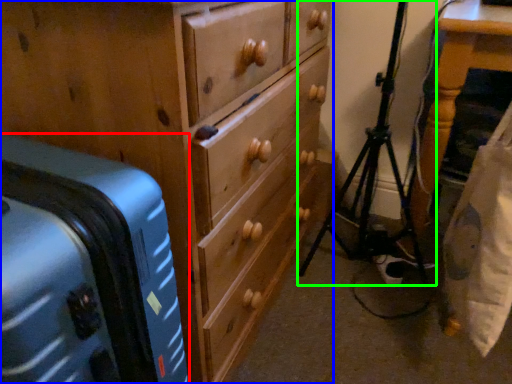
Question: Which object is positioned farthest from suitcase (highlighted by a red box)? Select from chest of drawers (highlighted by a blue box) and tripod (highlighted by a green box).

Choices:
 (A) chest of drawers
 (B) tripod

Answer: (B)